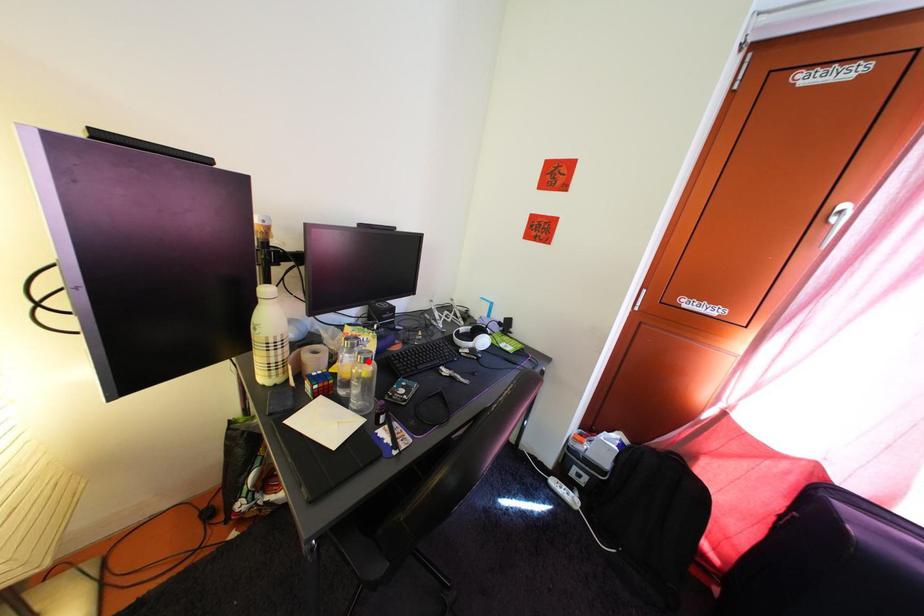
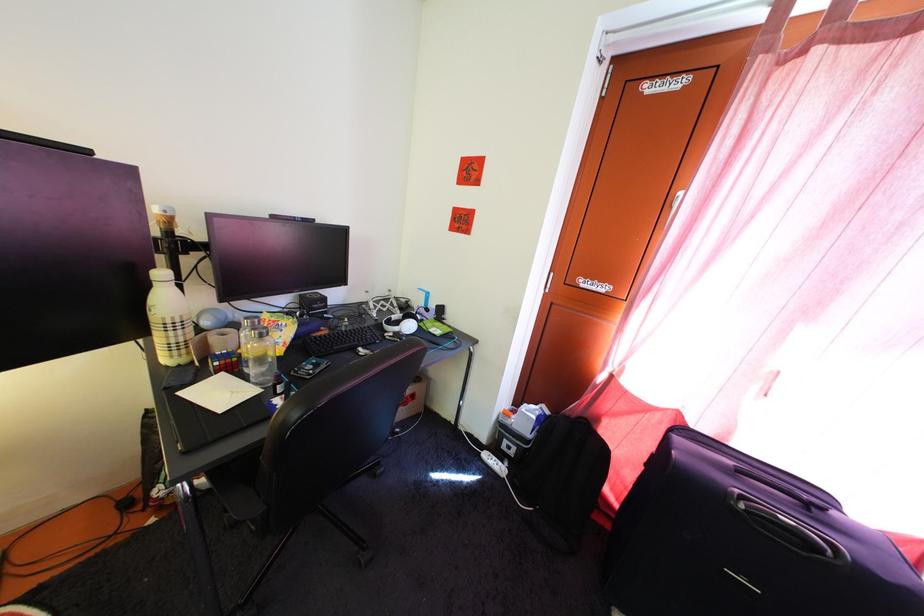
Find the pixel in the second image that matches the highlighted location in the first image.

(262, 338)